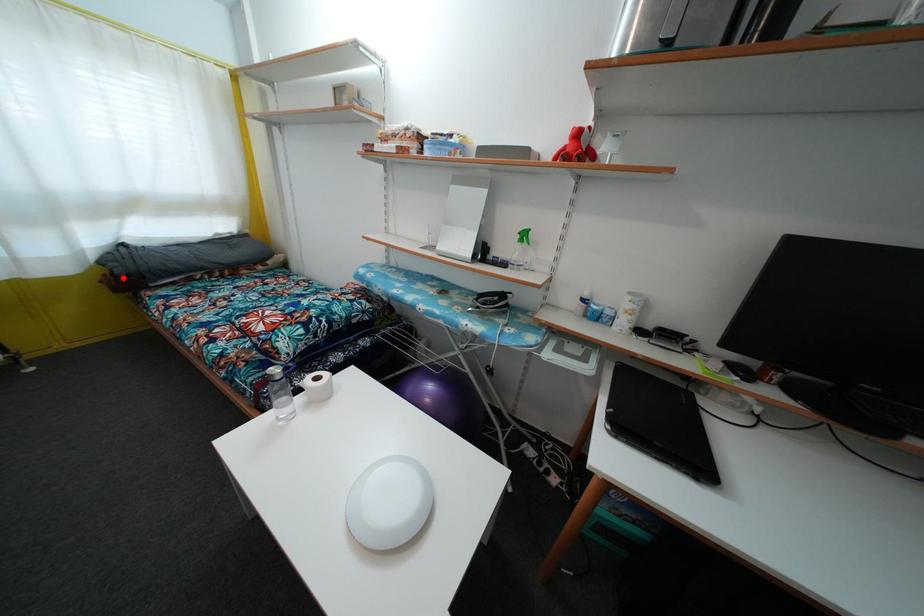
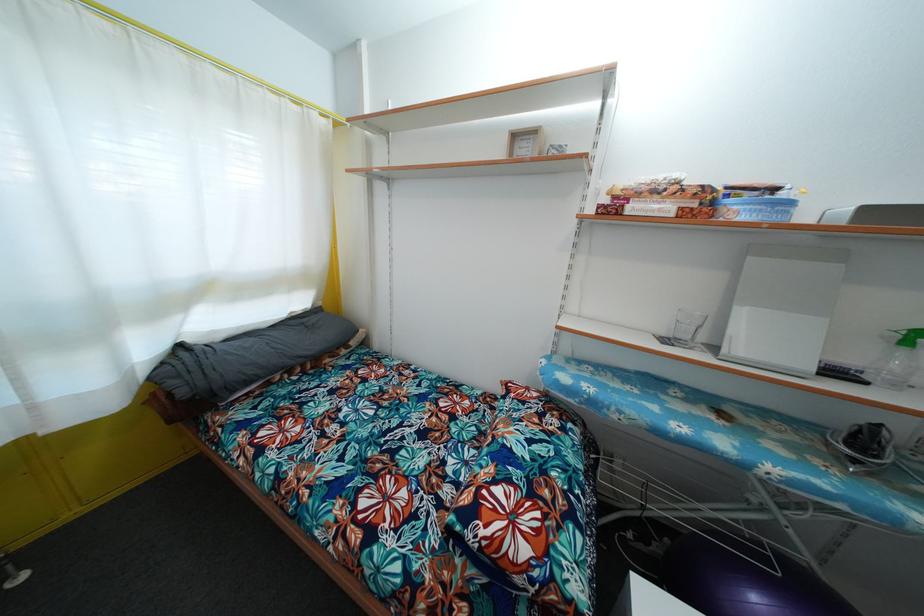
In the second image, find the point that corresponds to the highlighted location in the first image.

(187, 399)